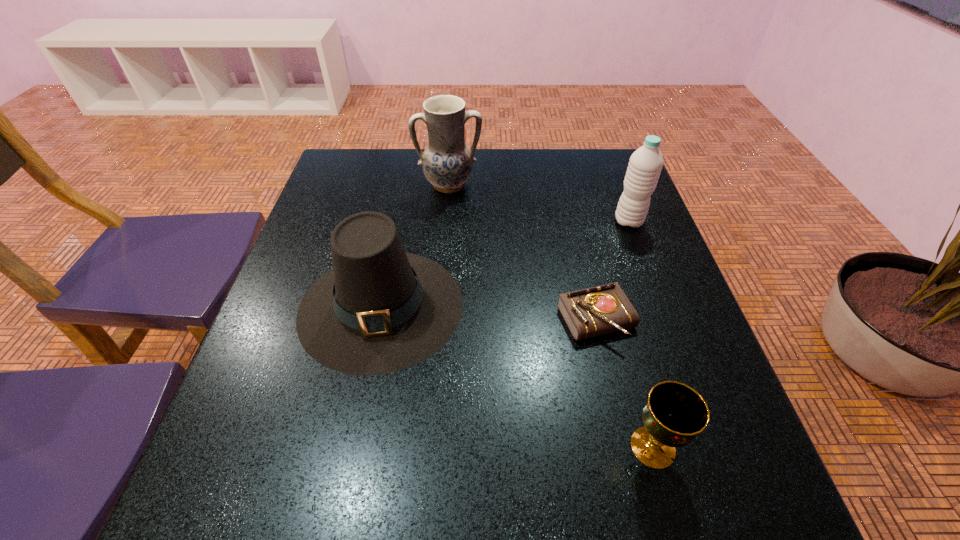
Locate an element on the screen. The image size is (960, 540). vacant space that satisfies the following two spatial constraints: 1. on the front side of the farthest object; 2. on the left side of the fourth nearest object is located at coordinates (446, 221).

Locate an element on the screen. This screenshot has height=540, width=960. vacant space that satisfies the following two spatial constraints: 1. on the back side of the chalice; 2. on the left side of the rightmost object is located at coordinates (590, 221).

Find the location of `free spot that satisfies the following two spatial constraints: 1. on the front-facing side of the nearest object; 2. on the right side of the third tallest object`. free spot that satisfies the following two spatial constraints: 1. on the front-facing side of the nearest object; 2. on the right side of the third tallest object is located at coordinates (352, 447).